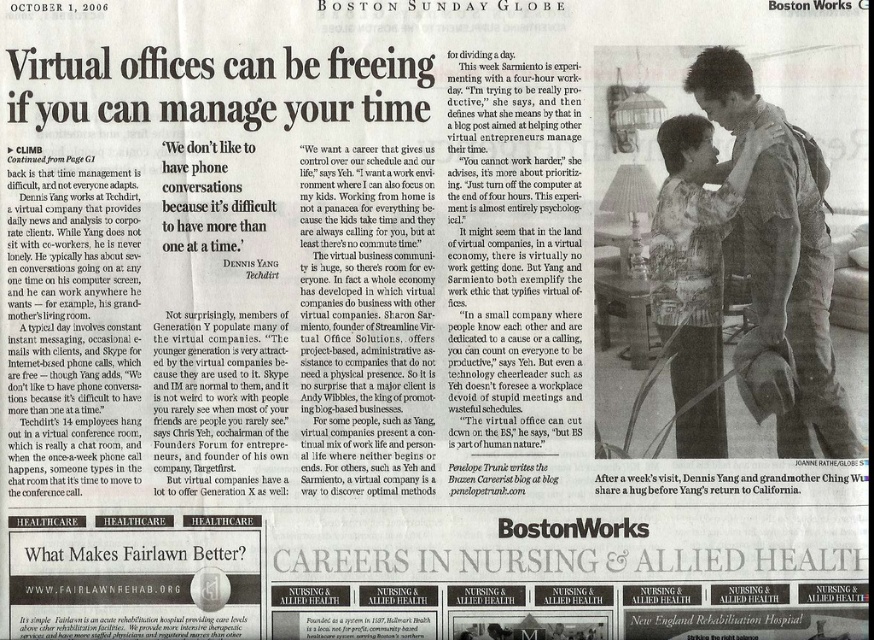
Question: Does light brown leather jacket at upper right come behind light brown textured shirt at upper right?

Choices:
 (A) yes
 (B) no

Answer: (B)

Question: Which point is closer to the camera?

Choices:
 (A) light brown textured shirt at upper right
 (B) light brown leather jacket at upper right

Answer: (B)

Question: Is light brown leather jacket at upper right to the left of light brown textured shirt at upper right from the viewer's perspective?

Choices:
 (A) yes
 (B) no

Answer: (B)

Question: Which of the following is the closest to the observer?

Choices:
 (A) light brown textured shirt at upper right
 (B) light brown leather jacket at upper right

Answer: (B)

Question: Observing the image, what is the correct spatial positioning of light brown leather jacket at upper right in reference to light brown textured shirt at upper right?

Choices:
 (A) above
 (B) below

Answer: (A)